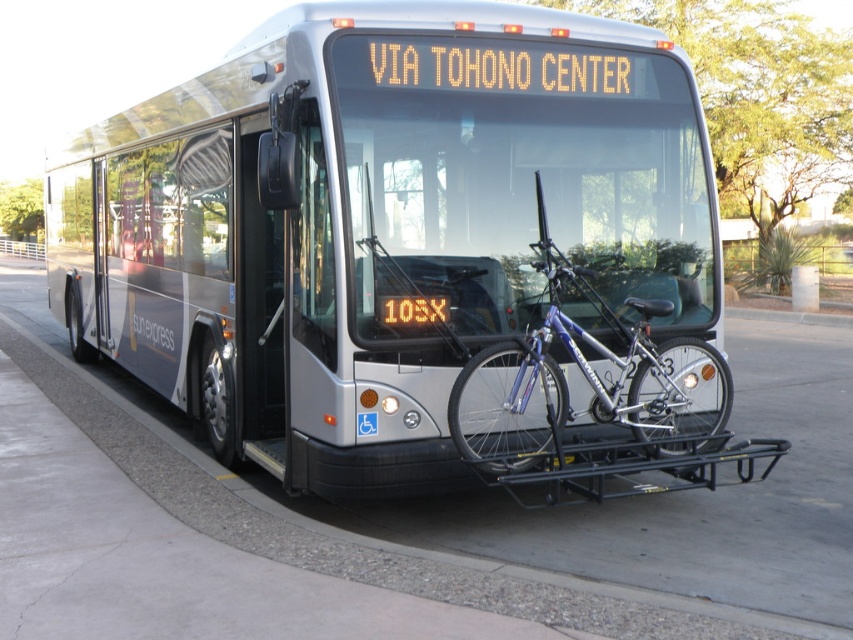
Question: Which of the following is the closest to the observer?

Choices:
 (A) silver metallic bus at center
 (B) gray concrete pavement at lower center
 (C) silver metallic bicycle at center

Answer: (B)

Question: Which point is closer to the camera taking this photo?

Choices:
 (A) (302, 292)
 (B) (572, 356)

Answer: (A)

Question: Based on their relative distances, which object is nearer to the gray concrete pavement at lower center?

Choices:
 (A) silver metallic bus at center
 (B) silver metallic bicycle at center

Answer: (B)

Question: Can you confirm if silver metallic bus at center is positioned below silver metallic bicycle at center?

Choices:
 (A) no
 (B) yes

Answer: (A)

Question: Can you confirm if silver metallic bus at center is bigger than gray concrete pavement at lower center?

Choices:
 (A) no
 (B) yes

Answer: (A)

Question: From the image, what is the correct spatial relationship of gray concrete pavement at lower center in relation to silver metallic bicycle at center?

Choices:
 (A) above
 (B) below

Answer: (B)